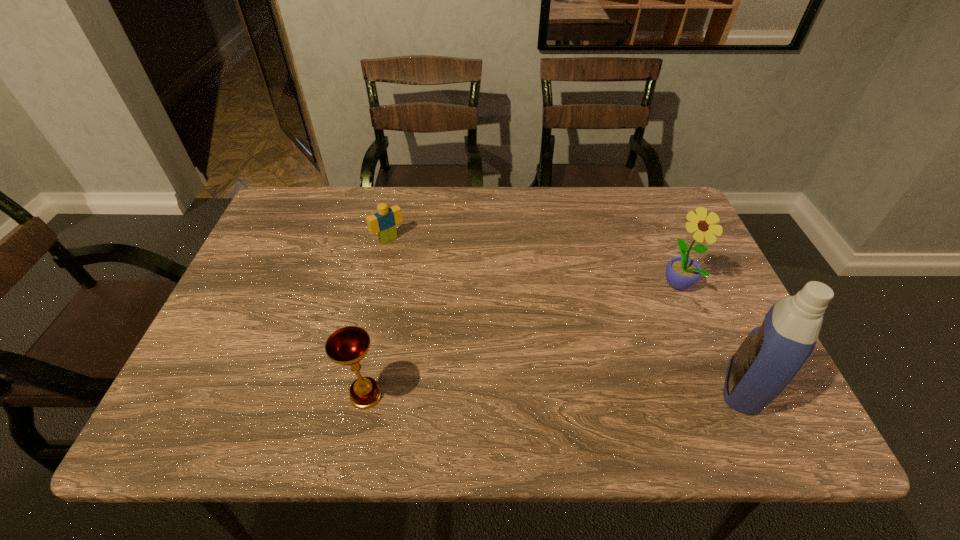
You are a GUI agent. You are given a task and a screenshot of the screen. Output one action in this format:
    pyautogui.click(x=<x>, y=<y>)
    Task: Click on the vacant space positioned on the face of the Lego
    This screenshot has width=960, height=540.
    Given the screenshot: What is the action you would take?
    [413, 265]

Where is `free space located on the front-facing side of the third shortest object`? The height and width of the screenshot is (540, 960). free space located on the front-facing side of the third shortest object is located at coordinates (588, 351).

Find the location of `vacant space located on the front-facing side of the third shortest object`. vacant space located on the front-facing side of the third shortest object is located at coordinates (571, 362).

Find the location of a particular element. This screenshot has height=540, width=960. free space located on the front-facing side of the third shortest object is located at coordinates (609, 335).

Locate an element on the screen. Image resolution: width=960 pixels, height=540 pixels. object at the far edge is located at coordinates (384, 222).

In order to click on chalice that is at the near edge in this screenshot , I will do `click(346, 346)`.

What are the coordinates of `detergent at the near edge` in the screenshot? It's located at (772, 354).

This screenshot has height=540, width=960. What are the coordinates of `detergent at the right edge` in the screenshot? It's located at (772, 354).

Locate an element on the screen. This screenshot has width=960, height=540. sunflower that is at the right edge is located at coordinates (682, 273).

At what (x,y) coordinates should I click in order to perform the action: click on object that is at the near right corner. Please return your answer as a coordinate pair (x, y). This screenshot has width=960, height=540. Looking at the image, I should click on (772, 354).